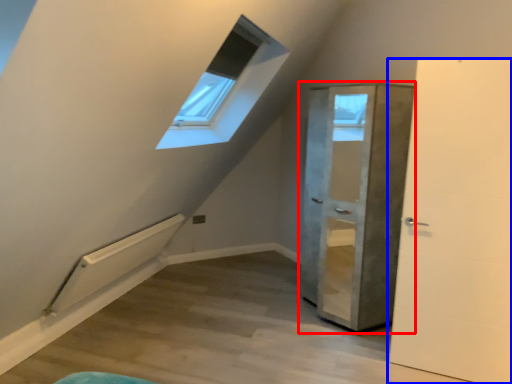
Question: Which of the following is the closest to the observer, door (highlighted by a red box) or door (highlighted by a blue box)?

Choices:
 (A) door
 (B) door

Answer: (B)